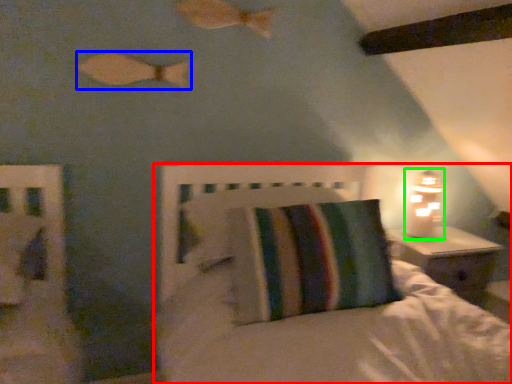
Question: Based on their relative distances, which object is farther from bed (highlighted by a red box)? Choose from fish (highlighted by a blue box) and table lamp (highlighted by a green box).

Choices:
 (A) fish
 (B) table lamp

Answer: (A)